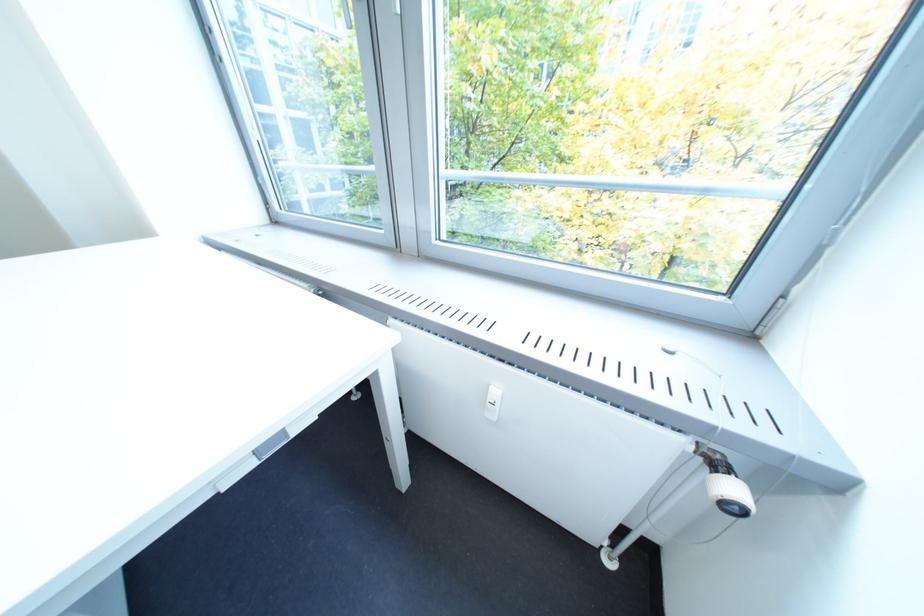
The image size is (924, 616). What are the coordinates of `radiator valve` in the screenshot? It's located at (730, 495).